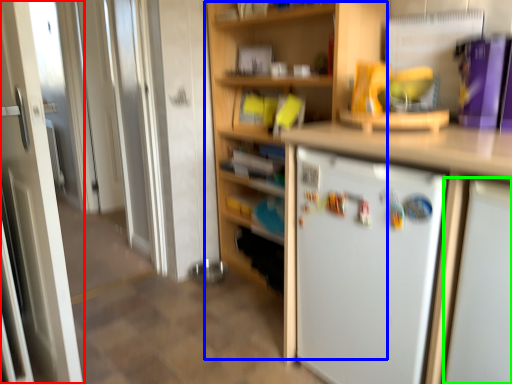
Question: Considering the real-world distances, which object is closest to door (highlighted by a red box)? bookshelf (highlighted by a blue box) or appliance (highlighted by a green box).

Choices:
 (A) bookshelf
 (B) appliance

Answer: (A)